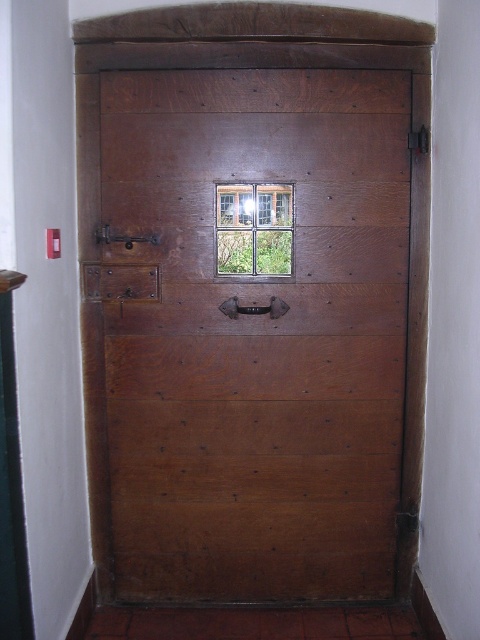
Is the position of matte wood door at center more distant than that of wooden textured window at center?

No, it is not.

This screenshot has width=480, height=640. In order to click on matte wood door at center in this screenshot , I will do `click(249, 337)`.

Locate an element on the screen. Image resolution: width=480 pixels, height=640 pixels. matte wood door at center is located at coordinates (249, 337).